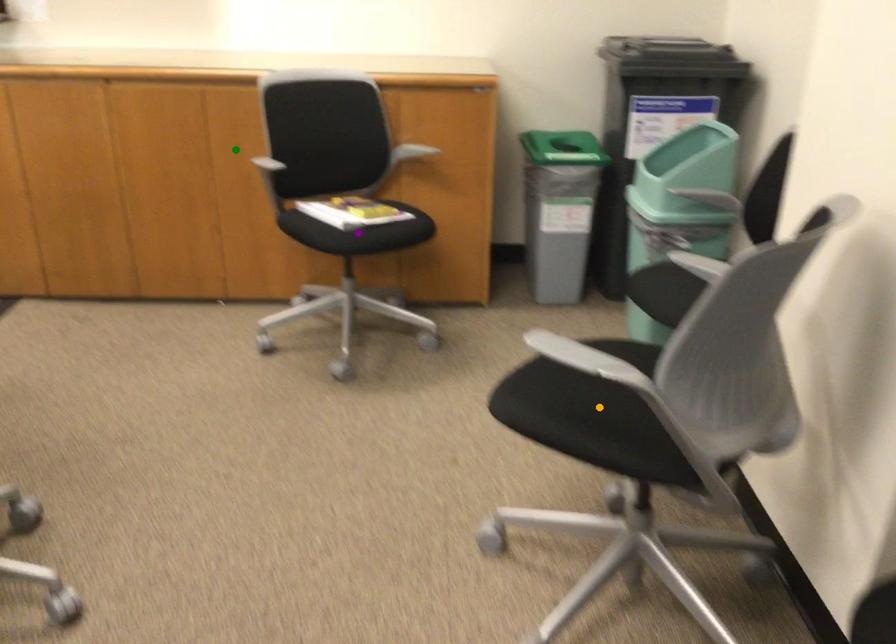
Order these from nearest to farthest:
green point | purple point | orange point

A: green point
purple point
orange point